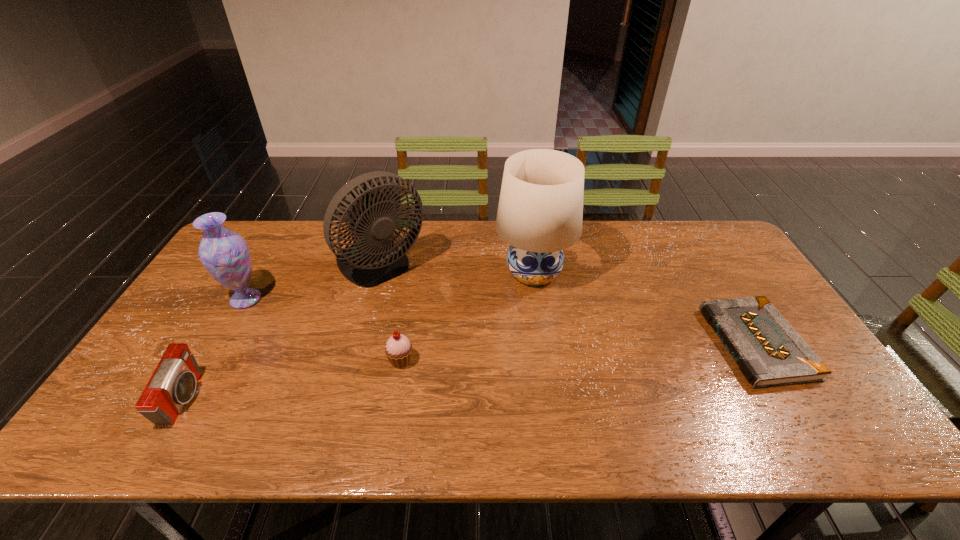
Find the location of `free space at the far edge of the desktop`. free space at the far edge of the desktop is located at coordinates click(613, 225).

In the image, there is a desktop. In order to click on vacant space at the near edge in this screenshot , I will do 246,430.

Image resolution: width=960 pixels, height=540 pixels. I want to click on vacant space at the left edge of the desktop, so click(212, 315).

Where is `vacant region at the right edge`? vacant region at the right edge is located at coordinates (736, 278).

Image resolution: width=960 pixels, height=540 pixels. I want to click on free region at the far left corner of the desktop, so pos(242,235).

In the image, there is a desktop. Where is `vacant space at the near right corner`? The width and height of the screenshot is (960, 540). vacant space at the near right corner is located at coordinates (839, 414).

Locate an element on the screen. The height and width of the screenshot is (540, 960). free space that is in between the camera and the fan is located at coordinates (282, 333).

You are a GUI agent. You are given a task and a screenshot of the screen. Output one action in this format:
    pyautogui.click(x=<x>, y=<y>)
    Task: Click on the free space between the lampshade and the vase
    Image resolution: width=960 pixels, height=540 pixels.
    Given the screenshot: What is the action you would take?
    pyautogui.click(x=390, y=286)

Find the location of a particular element. The image size is (960, 540). unoccupied area between the camera and the vase is located at coordinates (215, 349).

Identify the location of free space that is in between the fan and the notebook. The image size is (960, 540). (568, 305).